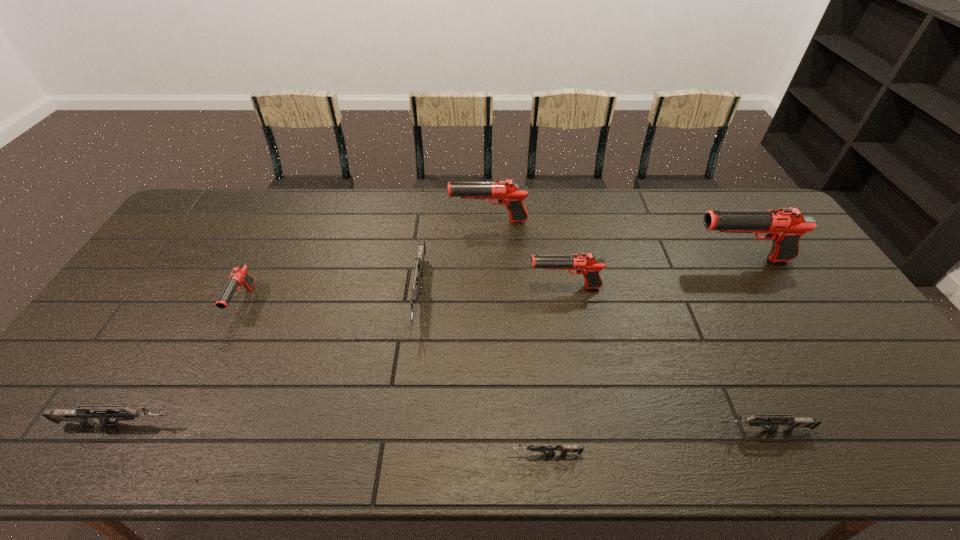
The image size is (960, 540). In the image, there is a desktop. What are the coordinates of `vacant space at the right edge` in the screenshot? It's located at (853, 351).

In the image, there is a desktop. What are the coordinates of `vacant area at the near left corner` in the screenshot? It's located at (26, 433).

Image resolution: width=960 pixels, height=540 pixels. In order to click on vacant region between the farthest gun and the second shortest gun in this screenshot , I will do `click(626, 326)`.

Where is `vacant area that lies between the tallest gun and the second smallest black gun`? The image size is (960, 540). vacant area that lies between the tallest gun and the second smallest black gun is located at coordinates (653, 273).

Locate an element on the screen. The width and height of the screenshot is (960, 540). vacant area that lies between the leftmost grey gun and the shortest gun is located at coordinates (332, 439).

The image size is (960, 540). Identify the location of vacant area that lies between the farthest gun and the second farthest black gun. (614, 240).

Locate an element on the screen. unoccupied position between the sixth object from right to left and the smallest black gun is located at coordinates (331, 298).

At what (x,y) coordinates should I click in order to perform the action: click on free space between the third biggest black gun and the third gun from left to right. Please return your answer as a coordinate pair (x, y). The image size is (960, 540). Looking at the image, I should click on (492, 291).

Locate an element on the screen. The image size is (960, 540). free space that is in between the shortest gun and the leftmost grey gun is located at coordinates (332, 439).

This screenshot has width=960, height=540. I want to click on free space between the leftmost black gun and the third shortest object, so click(x=181, y=363).